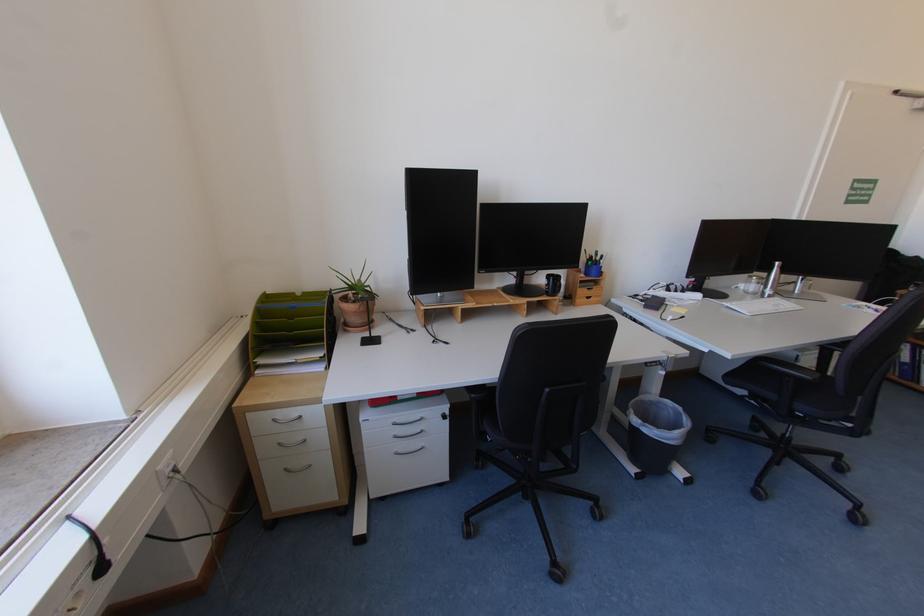
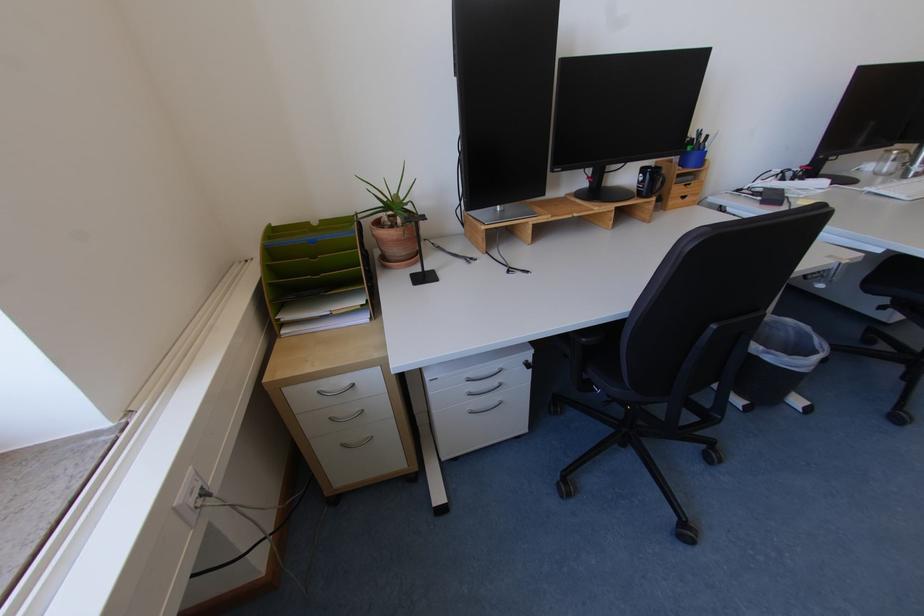
Find the pixel in the second image that matches point 400,422 in the first image.

(475, 378)